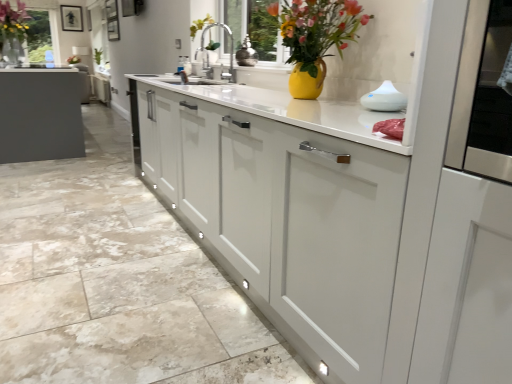
You are a GUI agent. You are given a task and a screenshot of the screen. Output one action in this format:
    pyautogui.click(x=<x>, y=<y>)
    Task: Click on the matte white cabinet at center, the 2th cabinetry when ordered from top to bottom
    The width and height of the screenshot is (512, 384).
    Given the screenshot: What is the action you would take?
    pyautogui.click(x=286, y=219)

You are a GUI agent. You are given a task and a screenshot of the screen. Output one action in this format:
    pyautogui.click(x=<x>, y=<y>)
    Task: Click on the matte black vase at upper left, which ranks as the 1th floral arrangement in left-to-right order
    The height and width of the screenshot is (384, 512).
    Given the screenshot: What is the action you would take?
    pyautogui.click(x=13, y=31)

The width and height of the screenshot is (512, 384). What do you see at coordinates (246, 54) in the screenshot?
I see `shiny metallic vase at center, positioned as the first appliance in left-to-right order` at bounding box center [246, 54].

The width and height of the screenshot is (512, 384). What do you see at coordinates (71, 18) in the screenshot?
I see `matte black picture frame at upper center` at bounding box center [71, 18].

Where is `matte yellow vase at upper center, positioned as the first floral arrangement in right-to-left order`? This screenshot has width=512, height=384. matte yellow vase at upper center, positioned as the first floral arrangement in right-to-left order is located at coordinates (315, 38).

From the picture: Do you think matte black picture frame at upper center is within matte yellow vase at upper center, positioned as the 2th floral arrangement in left-to-right order, or outside of it?

matte black picture frame at upper center is spatially situated outside matte yellow vase at upper center, positioned as the 2th floral arrangement in left-to-right order.

Is point (72, 8) behind point (355, 23)?

That is True.

Looking at their sizes, would you say matte black picture frame at upper center is wider or thinner than matte yellow vase at upper center, positioned as the 2th floral arrangement in left-to-right order?

matte black picture frame at upper center is thinner than matte yellow vase at upper center, positioned as the 2th floral arrangement in left-to-right order.

Between matte black picture frame at upper center and matte yellow vase at upper center, arranged as the second floral arrangement when viewed from the top, which one is positioned in front?

Positioned in front is matte yellow vase at upper center, arranged as the second floral arrangement when viewed from the top.

How many degrees apart are the facing directions of white matte cabinet at center, marked as the 2th cabinetry in a front-to-back arrangement, and matte black picture frame at upper center?

They differ by 91.6 degrees in their facing directions.

Which object is wider, white matte cabinet at center, which appears as the first cabinetry when viewed from the back, or matte black picture frame at upper center?

white matte cabinet at center, which appears as the first cabinetry when viewed from the back.

Can you confirm if white matte cabinet at center, which is the 1th cabinetry in top-to-bottom order, is bigger than matte black picture frame at upper center?

Yes, white matte cabinet at center, which is the 1th cabinetry in top-to-bottom order, is bigger than matte black picture frame at upper center.

Relative to matte black picture frame at upper center, is white matte cabinet at center, positioned as the second cabinetry in bottom-to-top order, in front or behind?

white matte cabinet at center, positioned as the second cabinetry in bottom-to-top order, is positioned closer to the viewer than matte black picture frame at upper center.

From a real-world perspective, is matte yellow vase at upper center, the 2th floral arrangement viewed from the back, located higher than matte black picture frame at upper center?

Incorrect, from a real-world perspective, matte yellow vase at upper center, the 2th floral arrangement viewed from the back, is lower than matte black picture frame at upper center.

Is matte yellow vase at upper center, marked as the 1th floral arrangement in a bottom-to-top arrangement, positioned with its back to matte black picture frame at upper center?

No, matte yellow vase at upper center, marked as the 1th floral arrangement in a bottom-to-top arrangement,'s orientation is not away from matte black picture frame at upper center.

Is matte yellow vase at upper center, the first floral arrangement in the front-to-back sequence, next to matte black picture frame at upper center?

No, matte yellow vase at upper center, the first floral arrangement in the front-to-back sequence, is not beside matte black picture frame at upper center.

From the image's perspective, is matte yellow vase at upper center, the 2th floral arrangement viewed from the back, under matte black picture frame at upper center?

Yes, from the image's perspective, matte yellow vase at upper center, the 2th floral arrangement viewed from the back, is beneath matte black picture frame at upper center.

Does matte black picture frame at upper center have a larger size compared to shiny metallic vase at center, the 1th appliance when ordered from top to bottom?

Indeed, matte black picture frame at upper center has a larger size compared to shiny metallic vase at center, the 1th appliance when ordered from top to bottom.

The image size is (512, 384). In order to click on picture frame located above the shiny metallic vase at center, positioned as the first appliance in back-to-front order (from a real-world perspective) in this screenshot , I will do `click(71, 18)`.

From the image's perspective, which one is positioned lower, matte black picture frame at upper center or shiny metallic vase at center, the second appliance in the front-to-back sequence?

shiny metallic vase at center, the second appliance in the front-to-back sequence, from the image's perspective.

Is matte black picture frame at upper center outside of shiny metallic vase at center, the 1th appliance when ordered from top to bottom?

matte black picture frame at upper center is positioned outside shiny metallic vase at center, the 1th appliance when ordered from top to bottom.

What are the coordinates of `the 2nd appliance counting from the right side of the matte black picture frame at upper center` in the screenshot? It's located at (384, 99).

In the scene shown: Could you tell me if white glossy diffuser at upper right, placed as the first appliance when sorted from bottom to top, is facing matte black picture frame at upper center?

No, white glossy diffuser at upper right, placed as the first appliance when sorted from bottom to top, is not aimed at matte black picture frame at upper center.

In the scene shown: Can you confirm if white glossy diffuser at upper right, the 2th appliance positioned from the back, is positioned to the left of matte black picture frame at upper center?

No.

Is matte yellow vase at upper center, positioned as the first floral arrangement in right-to-left order, located outside white matte cabinet at center, marked as the 2th cabinetry in a front-to-back arrangement?

matte yellow vase at upper center, positioned as the first floral arrangement in right-to-left order, is positioned outside white matte cabinet at center, marked as the 2th cabinetry in a front-to-back arrangement.

Are matte yellow vase at upper center, arranged as the second floral arrangement when viewed from the top, and white matte cabinet at center, which is the 1th cabinetry in top-to-bottom order, beside each other?

No, matte yellow vase at upper center, arranged as the second floral arrangement when viewed from the top, is not in contact with white matte cabinet at center, which is the 1th cabinetry in top-to-bottom order.

Considering the sizes of objects matte yellow vase at upper center, the first floral arrangement in the front-to-back sequence, and white matte cabinet at center, which is the 1th cabinetry in top-to-bottom order, in the image provided, who is shorter, matte yellow vase at upper center, the first floral arrangement in the front-to-back sequence, or white matte cabinet at center, which is the 1th cabinetry in top-to-bottom order,?

Standing shorter between the two is matte yellow vase at upper center, the first floral arrangement in the front-to-back sequence.

In terms of size, does matte yellow vase at upper center, the first floral arrangement in the front-to-back sequence, appear bigger or smaller than white matte cabinet at center, which appears as the first cabinetry when viewed from the back?

Considering their sizes, matte yellow vase at upper center, the first floral arrangement in the front-to-back sequence, takes up less space than white matte cabinet at center, which appears as the first cabinetry when viewed from the back.

Is white matte cabinet at center, positioned as the second cabinetry in bottom-to-top order, smaller than matte white cabinet at center, the 1th cabinetry positioned from the front?

Yes, white matte cabinet at center, positioned as the second cabinetry in bottom-to-top order, is smaller than matte white cabinet at center, the 1th cabinetry positioned from the front.

Does white matte cabinet at center, which appears as the first cabinetry when viewed from the back, have a lesser width compared to matte white cabinet at center, the 2th cabinetry when ordered from top to bottom?

Indeed, white matte cabinet at center, which appears as the first cabinetry when viewed from the back, has a lesser width compared to matte white cabinet at center, the 2th cabinetry when ordered from top to bottom.

The height and width of the screenshot is (384, 512). Find the location of `cabinetry behind the matte white cabinet at center, the 1th cabinetry positioned from the front`. cabinetry behind the matte white cabinet at center, the 1th cabinetry positioned from the front is located at coordinates (101, 87).

At what (x,y) coordinates should I click in order to perform the action: click on picture frame located behind the matte yellow vase at upper center, positioned as the first floral arrangement in right-to-left order. Please return your answer as a coordinate pair (x, y). This screenshot has width=512, height=384. Looking at the image, I should click on (71, 18).

Where is `cabinetry that is the 1st object located below the matte black picture frame at upper center (from the image's perspective)`? cabinetry that is the 1st object located below the matte black picture frame at upper center (from the image's perspective) is located at coordinates (101, 87).

From the image, which object appears to be nearer to matte yellow vase at upper center, marked as the 1th floral arrangement in a bottom-to-top arrangement, shiny metallic vase at center, the second appliance in the front-to-back sequence, or white matte cabinet at center, which appears as the first cabinetry when viewed from the back?

Based on the image, shiny metallic vase at center, the second appliance in the front-to-back sequence, appears to be nearer to matte yellow vase at upper center, marked as the 1th floral arrangement in a bottom-to-top arrangement.

Based on their spatial positions, is shiny metallic vase at center, positioned as the first appliance in left-to-right order, or white glossy diffuser at upper right, arranged as the 1th appliance when viewed from the right, further from white matte cabinet at center, marked as the 2th cabinetry in a front-to-back arrangement?

white glossy diffuser at upper right, arranged as the 1th appliance when viewed from the right, is further to white matte cabinet at center, marked as the 2th cabinetry in a front-to-back arrangement.

From the image, which object appears to be nearer to matte black picture frame at upper center, white glossy diffuser at upper right, placed as the first appliance when sorted from bottom to top, or matte black vase at upper left, the 1th floral arrangement from the top?

matte black vase at upper left, the 1th floral arrangement from the top, is closer to matte black picture frame at upper center.

Looking at the image, which one is located further to matte black vase at upper left, which appears as the second floral arrangement when ordered from the bottom, white matte cabinet at center, which is the 1th cabinetry in top-to-bottom order, or shiny metallic vase at center, positioned as the first appliance in left-to-right order?

shiny metallic vase at center, positioned as the first appliance in left-to-right order.

Consider the image. Looking at the image, which one is located closer to matte black picture frame at upper center, matte yellow vase at upper center, the first floral arrangement in the front-to-back sequence, or matte white cabinet at center, which is the first cabinetry in bottom-to-top order?

The object closer to matte black picture frame at upper center is matte yellow vase at upper center, the first floral arrangement in the front-to-back sequence.

From the image, which object appears to be nearer to matte yellow vase at upper center, the 2th floral arrangement viewed from the back, white glossy diffuser at upper right, the first appliance in the front-to-back sequence, or matte black vase at upper left, placed as the 2th floral arrangement when sorted from front to back?

Based on the image, white glossy diffuser at upper right, the first appliance in the front-to-back sequence, appears to be nearer to matte yellow vase at upper center, the 2th floral arrangement viewed from the back.

Which object lies further to the anchor point matte white cabinet at center, placed as the second cabinetry when sorted from back to front, white glossy diffuser at upper right, the 2th appliance positioned from the back, or matte black vase at upper left, which is the second floral arrangement from right to left?

matte black vase at upper left, which is the second floral arrangement from right to left, is further to matte white cabinet at center, placed as the second cabinetry when sorted from back to front.

Considering their positions, is white matte cabinet at center, which appears as the first cabinetry when viewed from the back, positioned closer to shiny metallic vase at center, the second appliance viewed from the right, than matte black picture frame at upper center?

white matte cabinet at center, which appears as the first cabinetry when viewed from the back, lies closer to shiny metallic vase at center, the second appliance viewed from the right, than the other object.

Locate an element on the screen. floral arrangement between matte white cabinet at center, which is the first cabinetry in bottom-to-top order, and white glossy diffuser at upper right, placed as the first appliance when sorted from bottom to top is located at coordinates (315, 38).

Where is `appliance positioned between white glossy diffuser at upper right, the 2th appliance positioned from the back, and white matte cabinet at center, which appears as the first cabinetry when viewed from the back, from near to far`? This screenshot has height=384, width=512. appliance positioned between white glossy diffuser at upper right, the 2th appliance positioned from the back, and white matte cabinet at center, which appears as the first cabinetry when viewed from the back, from near to far is located at coordinates (246, 54).

The width and height of the screenshot is (512, 384). I want to click on floral arrangement between matte white cabinet at center, the 1th cabinetry positioned from the front, and shiny metallic vase at center, the second appliance viewed from the right, from front to back, so (315, 38).

Where is `floral arrangement between matte white cabinet at center, the 2th cabinetry when ordered from top to bottom, and matte black vase at upper left, which is the second floral arrangement from right to left, in the front-back direction`? floral arrangement between matte white cabinet at center, the 2th cabinetry when ordered from top to bottom, and matte black vase at upper left, which is the second floral arrangement from right to left, in the front-back direction is located at coordinates (315, 38).